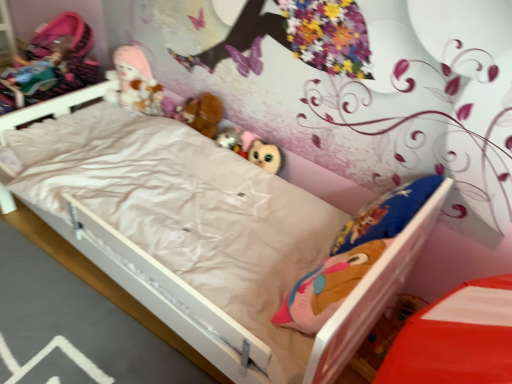
At what (x,y) coordinates should I click in order to perform the action: click on free location above white matte bed at center (from a real-world perspective). Please return your answer as a coordinate pair (x, y). Looking at the image, I should click on (70, 307).